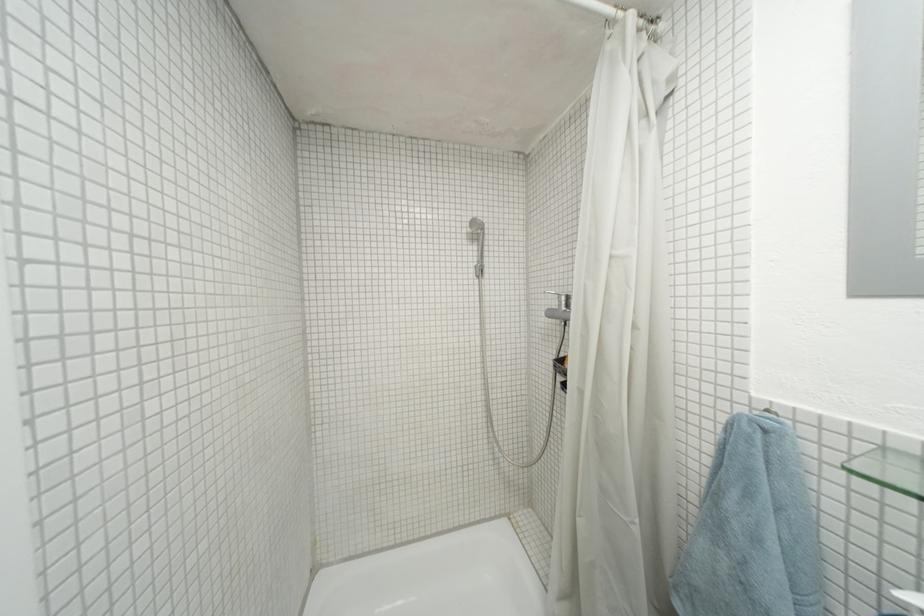
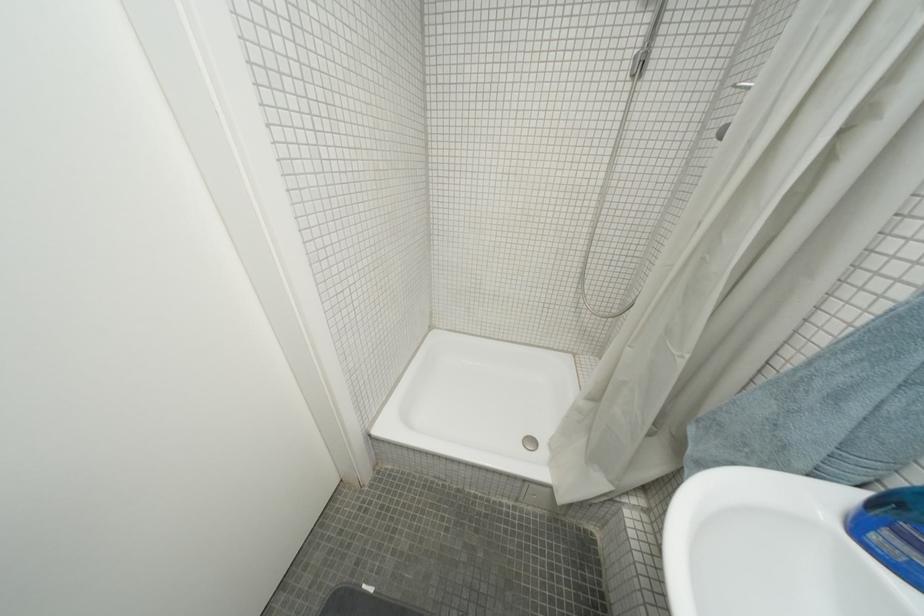
The images are taken continuously from a first-person perspective. In which direction is your viewpoint rotating?

The camera's rotation is toward left-down.